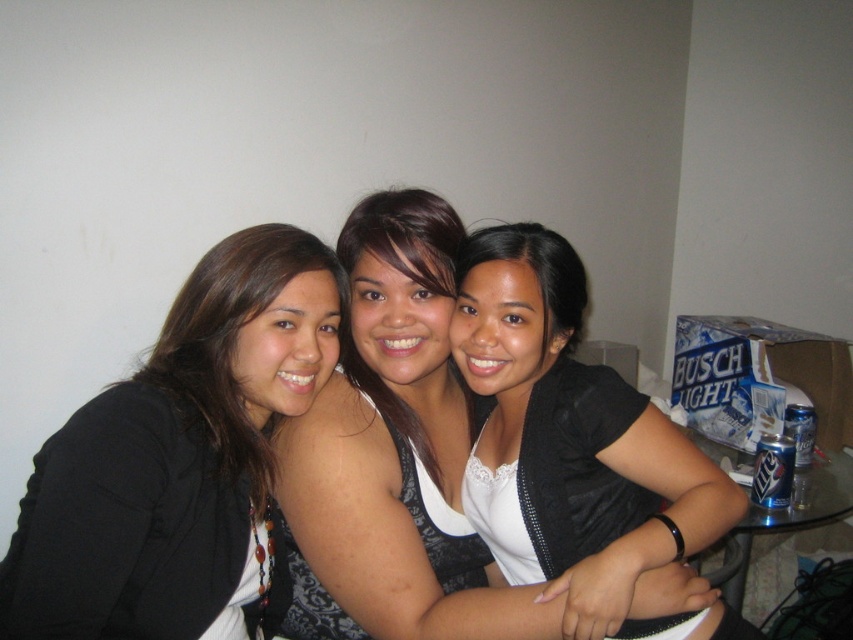
Is point (254, 228) positioned behind point (720, 634)?

No, it is in front of (720, 634).

Is matte black jacket at center to the left of black matte jacket at center from the viewer's perspective?

Correct, you'll find matte black jacket at center to the left of black matte jacket at center.

Between point (171, 541) and point (509, 252), which one is positioned behind?

The point (509, 252) is behind.

Locate an element on the screen. matte black jacket at center is located at coordinates (173, 458).